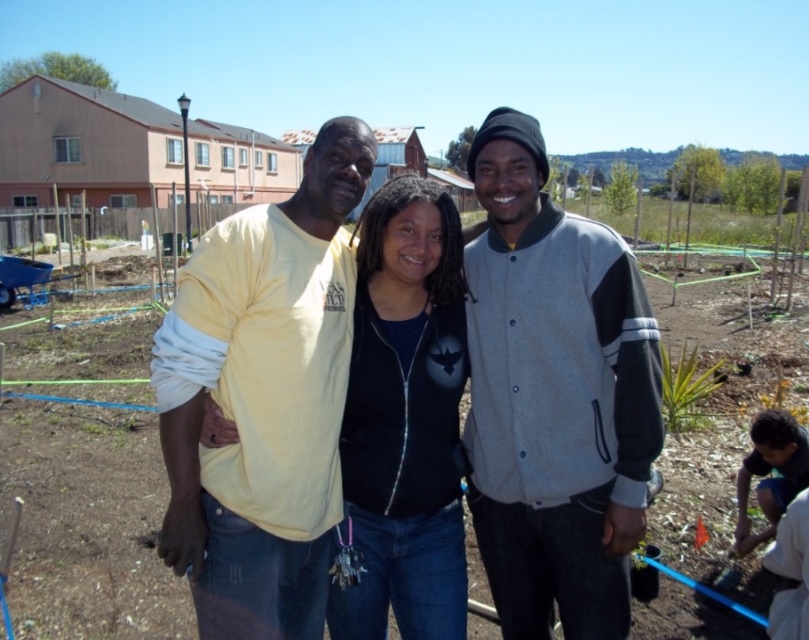
Question: Which point is closer to the camera taking this photo?

Choices:
 (A) (486, 211)
 (B) (159, 358)
 (C) (236, 380)

Answer: (B)

Question: Is yellow cotton shirt at center smaller than black matte jacket at center?

Choices:
 (A) yes
 (B) no

Answer: (B)

Question: Can you confirm if matte yellow shirt at center is thinner than black matte jacket at center?

Choices:
 (A) yes
 (B) no

Answer: (B)

Question: Estimate the real-world distances between objects in this image. Which object is farther from the gray woolen jacket at center?

Choices:
 (A) matte yellow shirt at center
 (B) yellow cotton shirt at center

Answer: (B)

Question: Does matte yellow shirt at center lie behind black matte jacket at center?

Choices:
 (A) no
 (B) yes

Answer: (A)

Question: Which point is closer to the camera?

Choices:
 (A) yellow cotton shirt at center
 (B) black matte jacket at center

Answer: (A)